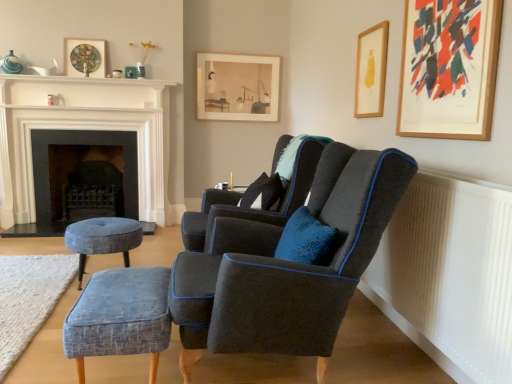
Question: Does textured blue ottoman at lower left turn towards white ribbed radiator at lower right?

Choices:
 (A) no
 (B) yes

Answer: (A)

Question: Can you confirm if textured blue ottoman at lower left is positioned to the right of white ribbed radiator at lower right?

Choices:
 (A) yes
 (B) no

Answer: (B)

Question: Considering the relative sizes of textured blue ottoman at lower left and white ribbed radiator at lower right in the image provided, is textured blue ottoman at lower left thinner than white ribbed radiator at lower right?

Choices:
 (A) yes
 (B) no

Answer: (B)

Question: Considering the relative sizes of textured blue ottoman at lower left and white ribbed radiator at lower right in the image provided, is textured blue ottoman at lower left wider than white ribbed radiator at lower right?

Choices:
 (A) yes
 (B) no

Answer: (A)

Question: Can you confirm if textured blue ottoman at lower left is smaller than white ribbed radiator at lower right?

Choices:
 (A) no
 (B) yes

Answer: (B)

Question: From the image's perspective, is textured blue ottoman at lower left beneath white ribbed radiator at lower right?

Choices:
 (A) no
 (B) yes

Answer: (B)

Question: Is velvet blue stool at lower left, positioned as the 1th stool in left-to-right order, a part of dark gray stone fireplace at left, the 2th fireplace when ordered from front to back?

Choices:
 (A) yes
 (B) no

Answer: (B)

Question: Is dark gray stone fireplace at left, the 2th fireplace when ordered from front to back, not close to velvet blue stool at lower left, positioned as the 1th stool in left-to-right order?

Choices:
 (A) yes
 (B) no

Answer: (A)

Question: Is dark gray stone fireplace at left, the 2th fireplace when ordered from front to back, closer to the viewer compared to velvet blue stool at lower left, marked as the first stool in a back-to-front arrangement?

Choices:
 (A) no
 (B) yes

Answer: (A)

Question: From a real-world perspective, is dark gray stone fireplace at left, the 2th fireplace when ordered from front to back, located beneath velvet blue stool at lower left, marked as the first stool in a back-to-front arrangement?

Choices:
 (A) no
 (B) yes

Answer: (A)

Question: Is dark gray stone fireplace at left, the 2th fireplace when ordered from front to back, to the right of velvet blue stool at lower left, which ranks as the 2th stool in front-to-back order, from the viewer's perspective?

Choices:
 (A) yes
 (B) no

Answer: (B)

Question: From the image's perspective, is dark gray stone fireplace at left, the 2th fireplace when ordered from front to back, on top of velvet blue stool at lower left, positioned as the 1th stool in left-to-right order?

Choices:
 (A) yes
 (B) no

Answer: (A)

Question: Is white ribbed radiator at lower right thinner than wooden picture frame at upper right, which ranks as the second picture frame in front-to-back order?

Choices:
 (A) yes
 (B) no

Answer: (B)